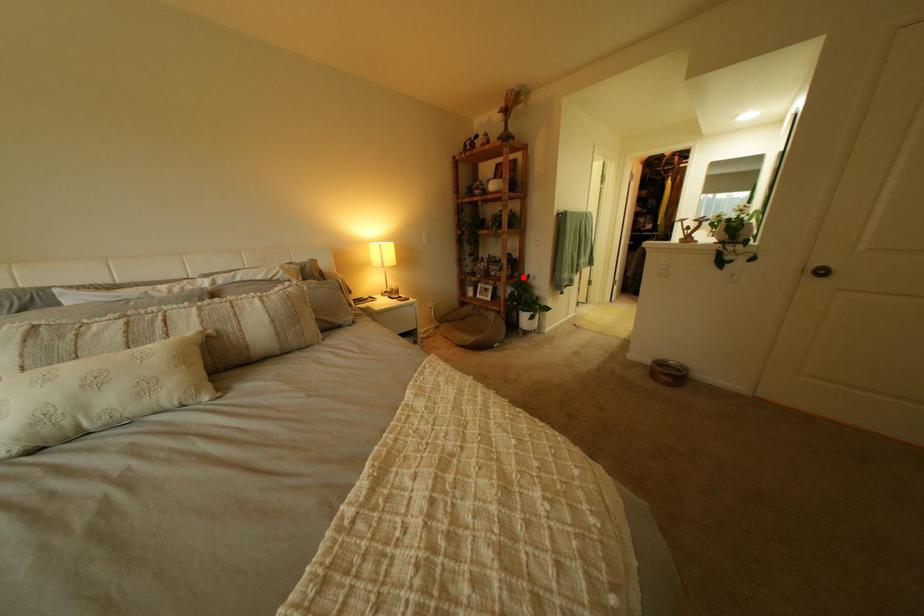
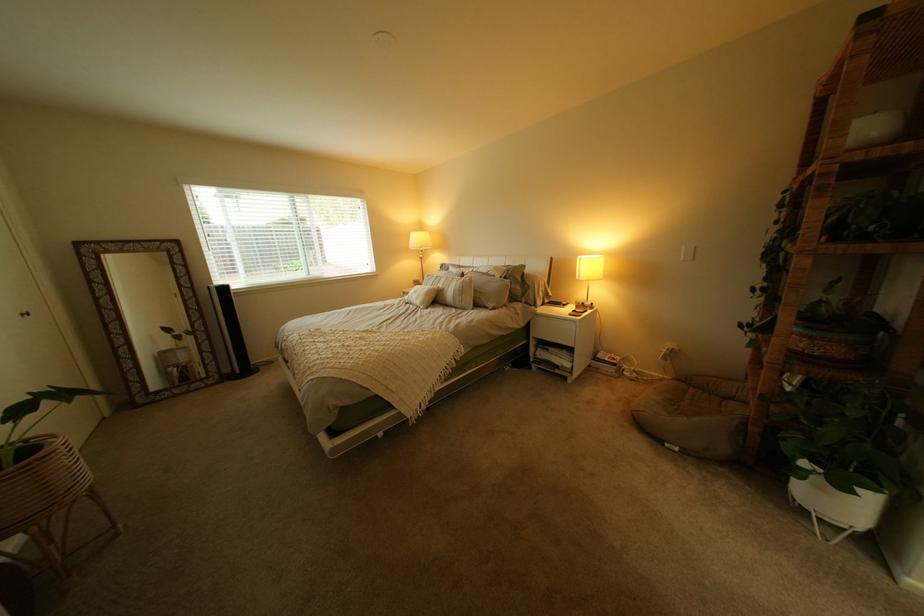
Question: I am providing you with two images of the same scene from different viewpoints. A red point is marked on the first image. Is the red point's position out of view in image 2?

Choices:
 (A) Yes
 (B) No

Answer: (B)